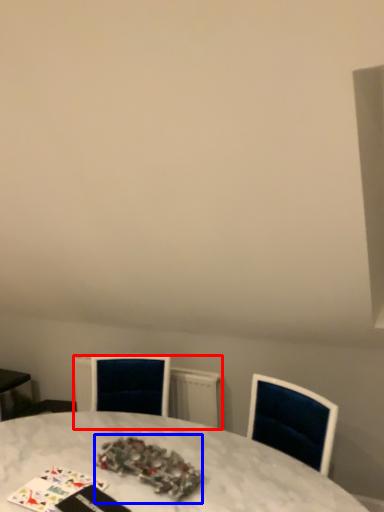
Question: Which of the following is the closest to the observer, radiator (highlighted by a red box) or christmas decoration (highlighted by a blue box)?

Choices:
 (A) radiator
 (B) christmas decoration

Answer: (B)